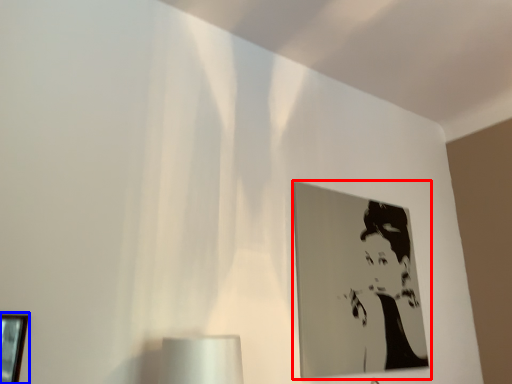
Question: Which of the following is the farthest to the observer, picture frame (highlighted by a red box) or picture frame (highlighted by a blue box)?

Choices:
 (A) picture frame
 (B) picture frame

Answer: (A)